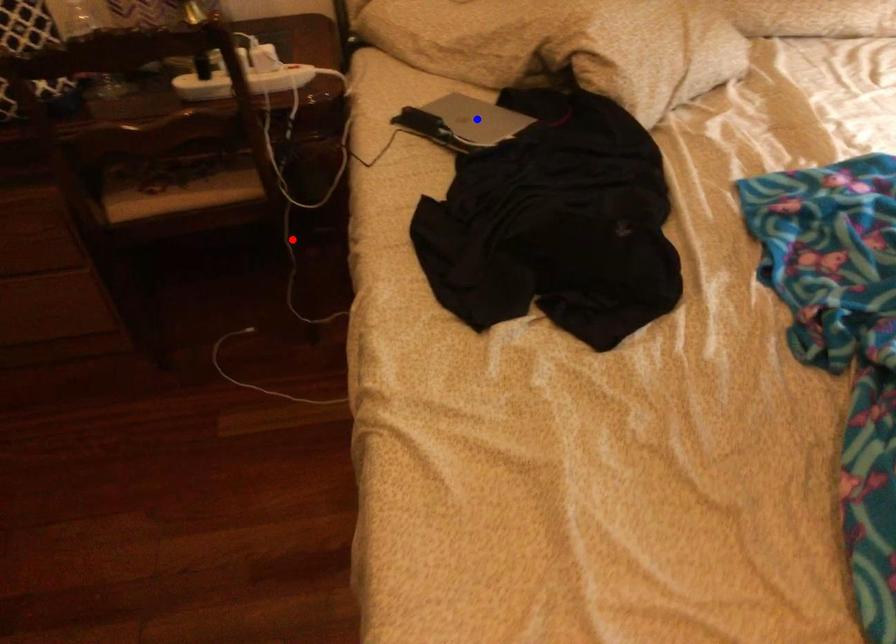
Question: In the image, two points are highlighted. Which point is nearer to the camera? Reply with the corresponding letter.

Choices:
 (A) blue point
 (B) red point

Answer: (A)